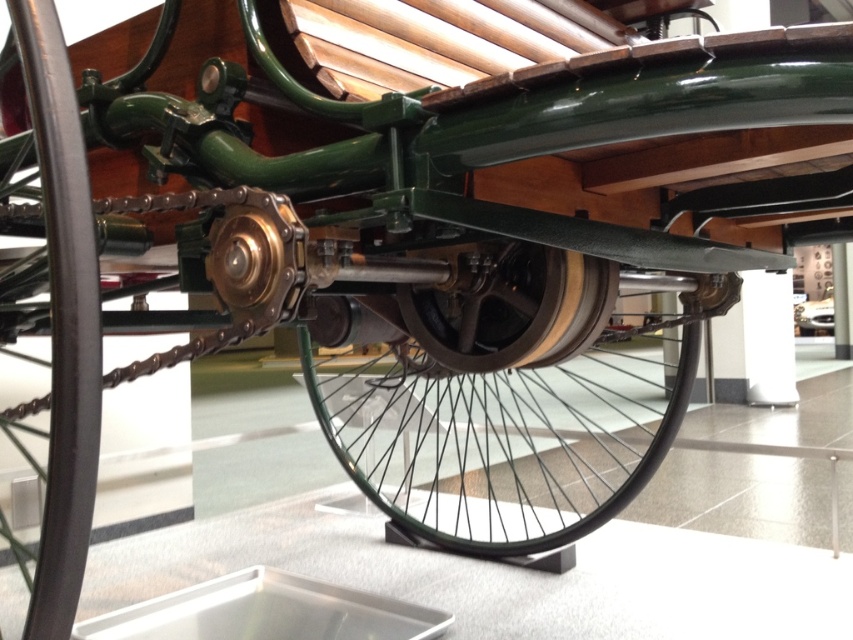
Can you confirm if green wire-spoke wheel at center is smaller than black rubber tire at lower left?

No.

Is the position of green wire-spoke wheel at center less distant than that of black rubber tire at lower left?

No, green wire-spoke wheel at center is behind black rubber tire at lower left.

Measure the distance between point [466,388] and camera.

They are 2.95 meters apart.

Identify the location of green wire-spoke wheel at center. (498, 404).

Is black rubber tire at lower left bigger than shiny black tire at center?

Actually, black rubber tire at lower left might be smaller than shiny black tire at center.

Who is lower down, black rubber tire at lower left or shiny black tire at center?

black rubber tire at lower left

The height and width of the screenshot is (640, 853). Describe the element at coordinates (62, 321) in the screenshot. I see `black rubber tire at lower left` at that location.

Find the location of `black rubber tire at lower left`. black rubber tire at lower left is located at coordinates (62, 321).

Can you confirm if green wire-spoke wheel at center is positioned to the right of shiny black tire at center?

Indeed, green wire-spoke wheel at center is positioned on the right side of shiny black tire at center.

Looking at this image, is green wire-spoke wheel at center wider than shiny black tire at center?

Yes, green wire-spoke wheel at center is wider than shiny black tire at center.

Between point (463, 260) and point (517, 364), which one is positioned behind?

The point (517, 364) is more distant.

This screenshot has width=853, height=640. What are the coordinates of `green wire-spoke wheel at center` in the screenshot? It's located at (498, 404).